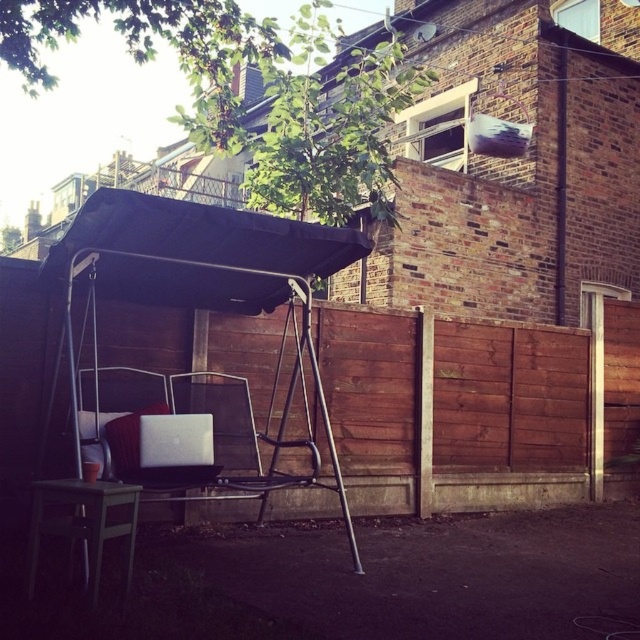
You are standing at the point with coordinates (211, 280) in the image. What object is located at your current position?

The point at coordinates (211, 280) indicates the location of the black metal swing at center.

You are planning to install a small table next to the black metal swing at center for placing a drink. Based on the coordinates provided in the Objects Description, where should you position the table relative to the swing?

The black metal swing at center is located at point (211, 280), so the table should be positioned to the side of the swing at those coordinates to ensure it is easily accessible.

You are a delivery person carrying a package that measures 1.2 meters in length. You need to navigate through the space between the black fabric canopy at center and the green matte stool at lower left to reach the front door. Can your package fit through this space without bending it?

The distance between the black fabric canopy at center and the green matte stool at lower left is 1.17 meters. Since the package is 1.2 meters long, it is slightly longer than the available space. Therefore, the package cannot fit through the space without bending it.